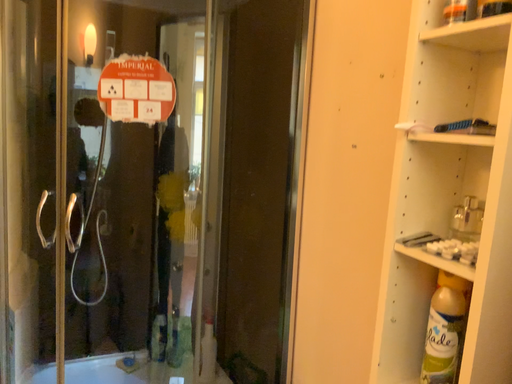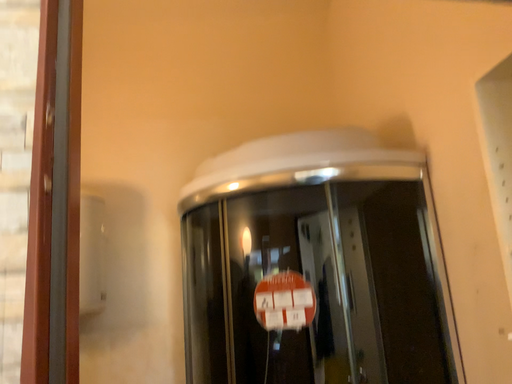
Question: How did the camera likely rotate when shooting the video?

Choices:
 (A) rotated left
 (B) rotated right

Answer: (A)